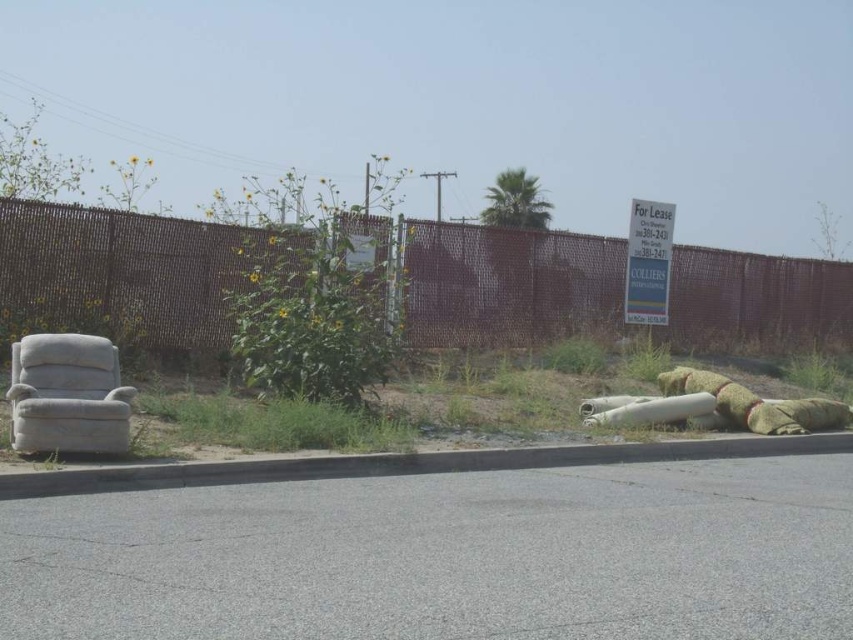
Can you confirm if brown mesh fence at center is positioned below white fabric armchair at left?

No.

Which is above, brown mesh fence at center or white fabric armchair at left?

brown mesh fence at center is above.

Describe the element at coordinates (119, 273) in the screenshot. The height and width of the screenshot is (640, 853). I see `brown mesh fence at center` at that location.

This screenshot has width=853, height=640. I want to click on brown mesh fence at center, so click(x=119, y=273).

Between gray asphalt curb at lower left and white fabric armchair at left, which one appears on the right side from the viewer's perspective?

Positioned to the right is gray asphalt curb at lower left.

How distant is gray asphalt curb at lower left from white fabric armchair at left?

gray asphalt curb at lower left and white fabric armchair at left are 1.55 meters apart.

I want to click on gray asphalt curb at lower left, so click(403, 464).

Is brown mesh fence at center wider than gray asphalt curb at lower left?

Yes, brown mesh fence at center is wider than gray asphalt curb at lower left.

Which is above, brown mesh fence at center or gray asphalt curb at lower left?

brown mesh fence at center is higher up.

Locate an element on the screen. This screenshot has width=853, height=640. brown mesh fence at center is located at coordinates [x=119, y=273].

Locate an element on the screen. Image resolution: width=853 pixels, height=640 pixels. brown mesh fence at center is located at coordinates (119, 273).